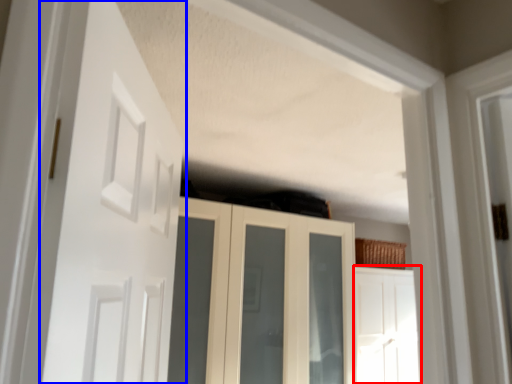
Question: Which point is further to the camera, door (highlighted by a red box) or door (highlighted by a blue box)?

Choices:
 (A) door
 (B) door

Answer: (A)